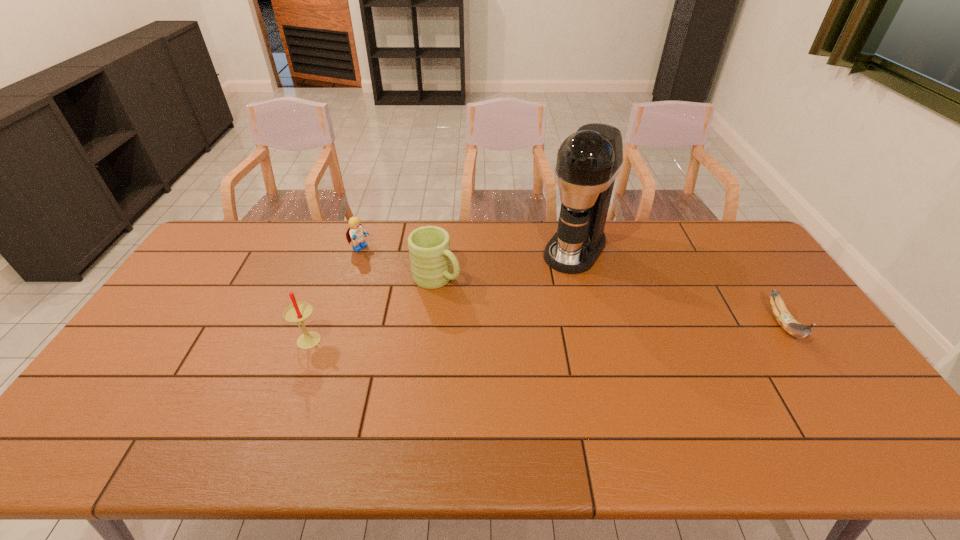
Identify the location of vacant area in the image that satisfies the following two spatial constraints: 1. on the back side of the candle; 2. on the left side of the fourth tallest object. The image size is (960, 540). (342, 249).